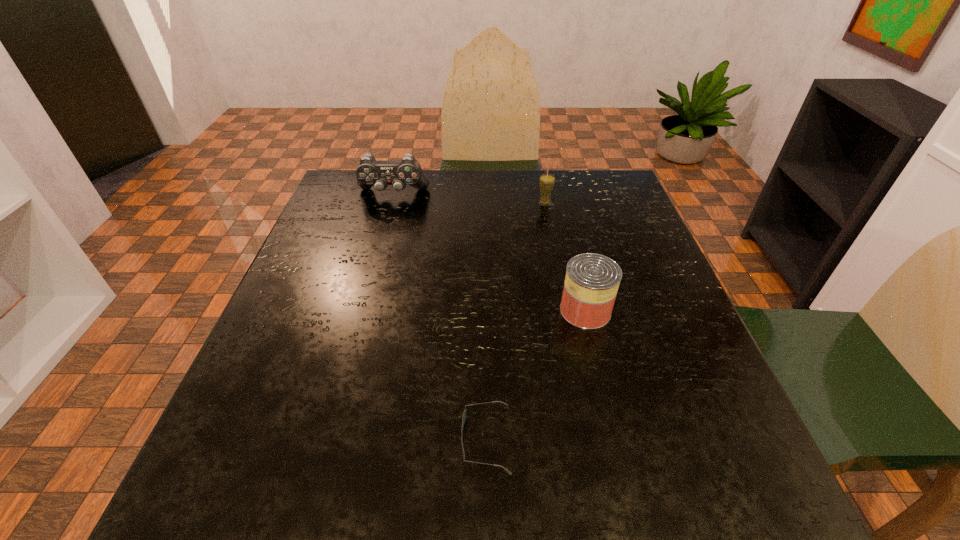
Locate an element on the screen. Image resolution: width=960 pixels, height=540 pixels. straw for drinking is located at coordinates (546, 181).

Identify the location of the leftmost object. The width and height of the screenshot is (960, 540). (370, 172).

Where is `the second nearest object`? This screenshot has width=960, height=540. the second nearest object is located at coordinates (592, 280).

Identify the location of the nearest object. (464, 414).

Where is `the second object from left to right`? The width and height of the screenshot is (960, 540). the second object from left to right is located at coordinates (464, 414).

This screenshot has height=540, width=960. I want to click on blank space located on the front of the straw for drinking, so (555, 255).

Where is `free space located 0.370m on the surface of the control with buttons`? free space located 0.370m on the surface of the control with buttons is located at coordinates (364, 302).

Identify the location of free location located 0.220m on the left of the can. The width and height of the screenshot is (960, 540). (449, 310).

In order to click on vacant space located on the lenses of the nearest object in this screenshot , I will do `click(247, 439)`.

The image size is (960, 540). In order to click on vacant region located 0.270m on the lenses of the nearest object in this screenshot , I will do `click(286, 439)`.